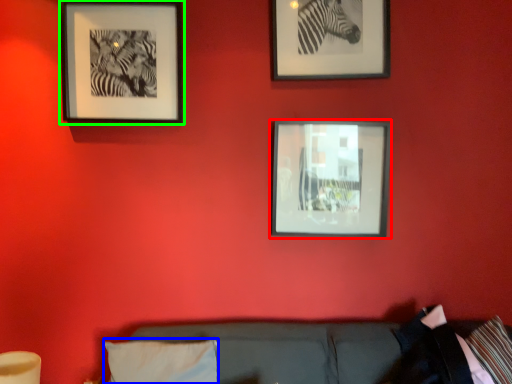
Question: Estimate the real-world distances between objects in this image. Which object is closer to picture frame (highlighted by a red box), pillow (highlighted by a blue box) or picture frame (highlighted by a green box)?

Choices:
 (A) pillow
 (B) picture frame

Answer: (B)